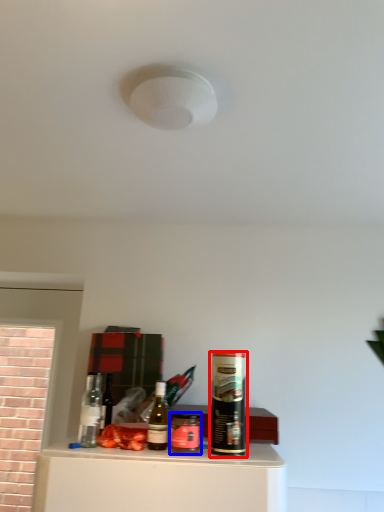
Question: Which object appears closest to the camera in this image, beverage (highlighted by a red box) or beverage (highlighted by a blue box)?

Choices:
 (A) beverage
 (B) beverage

Answer: (A)